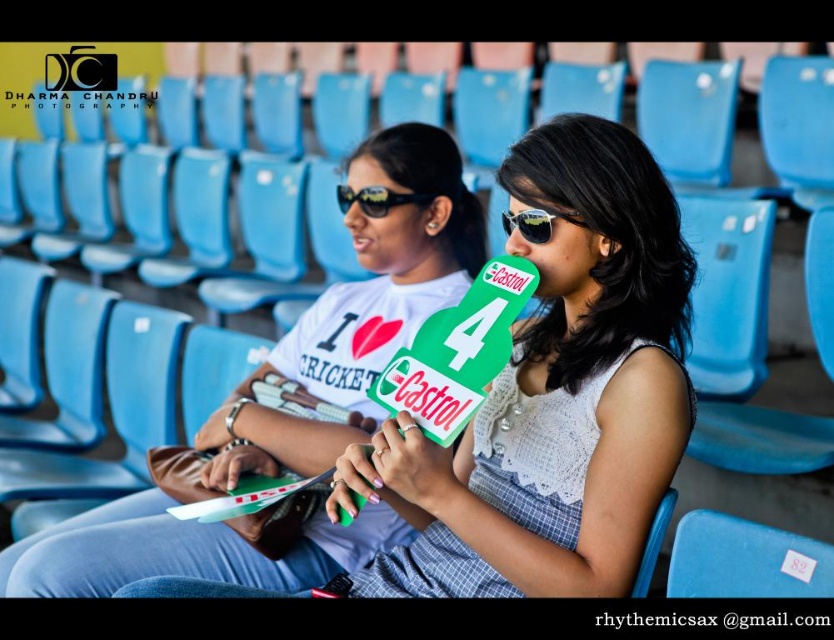
Based on the scene description, can you determine the position of the white fabric shirt at center relative to the black reflective sunglasses at center?

The white fabric shirt at center is positioned to the left of the black reflective sunglasses at center.

You are a photographer trying to capture a clear shot of the white fabric shirt at center and the black reflective sunglasses at center. Which object should you focus on to avoid blurring if you need to prioritize one due to limited depth of field?

The white fabric shirt at center is wider than the black reflective sunglasses at center, so focusing on the white fabric shirt at center would ensure it remains sharp, and the sunglasses might still be in acceptable focus due to their smaller size.